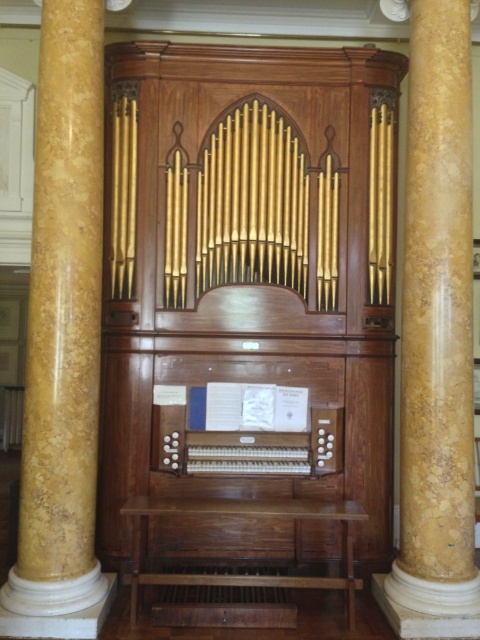
Question: Which object is farther from the camera taking this photo?

Choices:
 (A) marble column at center
 (B) marble column at right
 (C) wooden organ at center

Answer: (C)

Question: Which point appears closest to the camera in this image?

Choices:
 (A) (263, 467)
 (B) (67, 28)
 (C) (408, 608)

Answer: (C)

Question: Based on their relative distances, which object is nearer to the marble column at right?

Choices:
 (A) wooden organ at center
 (B) marble column at center

Answer: (A)

Question: Can you confirm if marble column at right is positioned to the right of wooden organ at center?

Choices:
 (A) yes
 (B) no

Answer: (A)

Question: Does marble column at right lie in front of wooden organ at center?

Choices:
 (A) no
 (B) yes

Answer: (B)

Question: From the image, what is the correct spatial relationship of marble column at center in relation to wooden organ at center?

Choices:
 (A) below
 (B) above

Answer: (B)